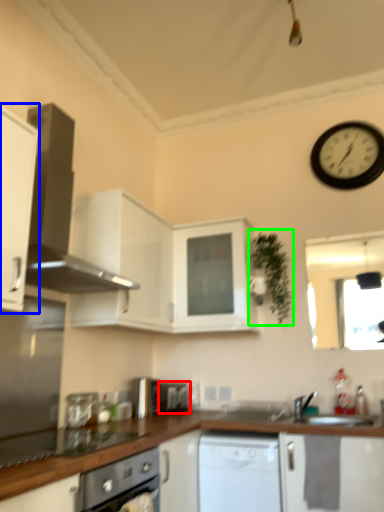
Question: Considering the real-world distances, which object is farthest from appliance (highlighted by a red box)? cabinetry (highlighted by a blue box) or plant (highlighted by a green box)?

Choices:
 (A) cabinetry
 (B) plant

Answer: (A)